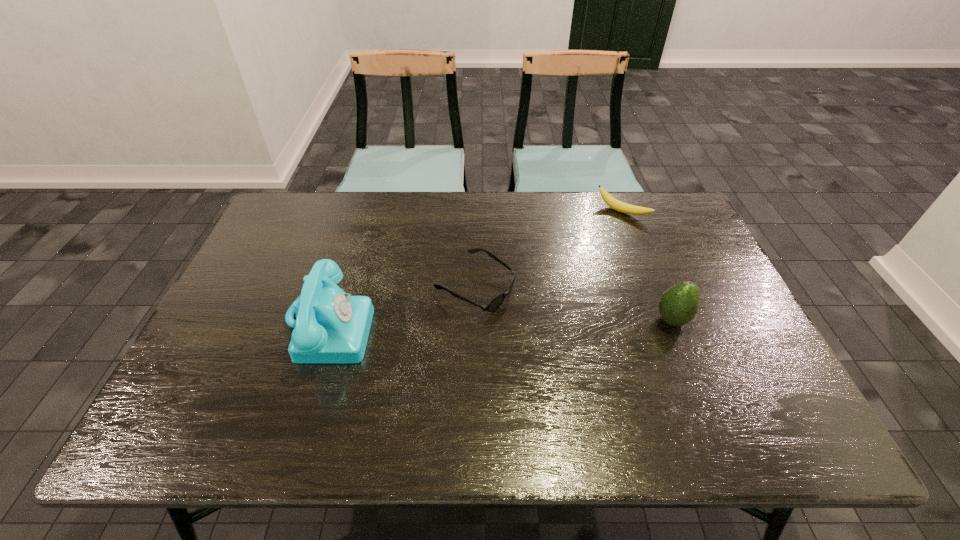
This screenshot has height=540, width=960. What are the coordinates of `free point between the farthest object and the telephone` in the screenshot? It's located at (475, 268).

The image size is (960, 540). In order to click on vacant area that lies between the sunglasses and the farthest object in this screenshot , I will do `click(549, 249)`.

The width and height of the screenshot is (960, 540). What are the coordinates of `vacant space that's between the sunglasses and the avocado` in the screenshot? It's located at (573, 303).

The height and width of the screenshot is (540, 960). Find the location of `free spot between the second tallest object and the sunglasses`. free spot between the second tallest object and the sunglasses is located at coordinates (573, 303).

Where is `vacant area that lies between the telephone and the farthest object`? The width and height of the screenshot is (960, 540). vacant area that lies between the telephone and the farthest object is located at coordinates (475, 268).

Select which object appears as the second closest to the sunglasses. Please provide its 2D coordinates. Your answer should be formatted as a tuple, i.e. [(x, y)], where the tuple contains the x and y coordinates of a point satisfying the conditions above.

[(615, 204)]

Identify which object is the third closest to the tallest object. Please provide its 2D coordinates. Your answer should be formatted as a tuple, i.e. [(x, y)], where the tuple contains the x and y coordinates of a point satisfying the conditions above.

[(678, 305)]

Locate an element on the screen. Image resolution: width=960 pixels, height=540 pixels. vacant position in the image that satisfies the following two spatial constraints: 1. on the front side of the farthest object; 2. on the right side of the avocado is located at coordinates (663, 320).

Find the location of a particular element. The height and width of the screenshot is (540, 960). free location that satisfies the following two spatial constraints: 1. on the front side of the farthest object; 2. on the left side of the avocado is located at coordinates (663, 320).

Find the location of a particular element. The image size is (960, 540). vacant space that satisfies the following two spatial constraints: 1. on the front side of the second tallest object; 2. on the left side of the sunglasses is located at coordinates (475, 320).